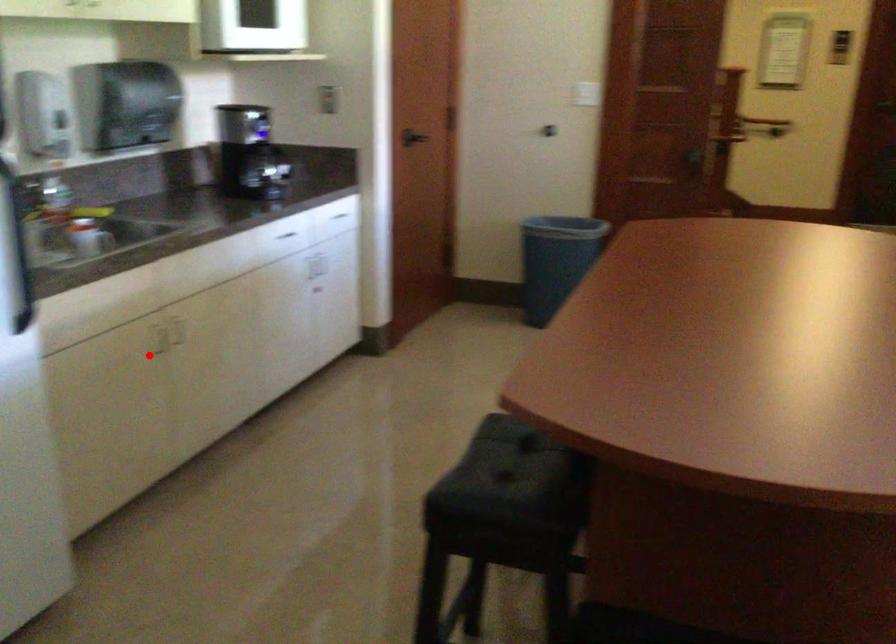
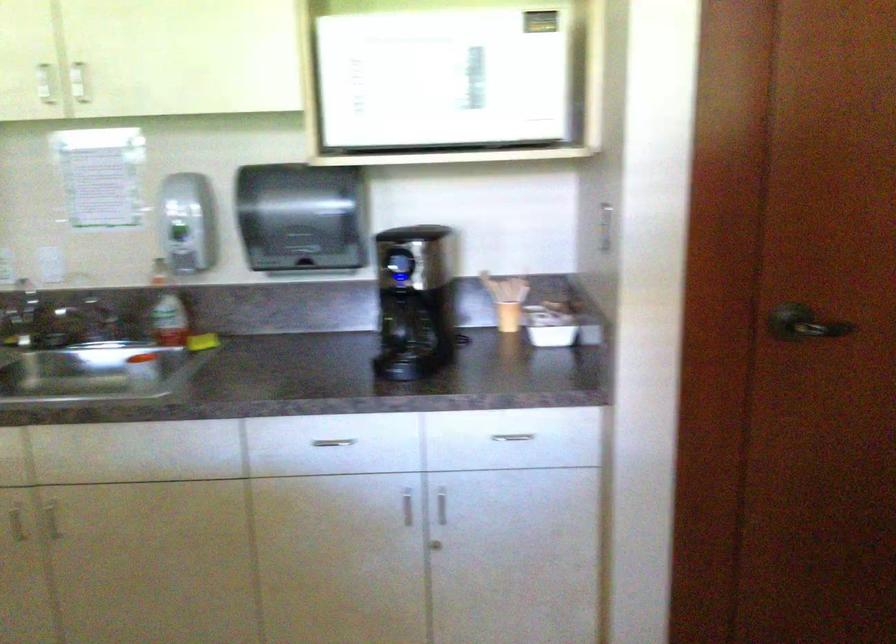
Question: I am providing you with two images of the same scene from different viewpoints. A red point is shown in image1. For the corresponding object point in image2, is it positioned nearer or farther from the camera?

Choices:
 (A) Nearer
 (B) Farther

Answer: (A)